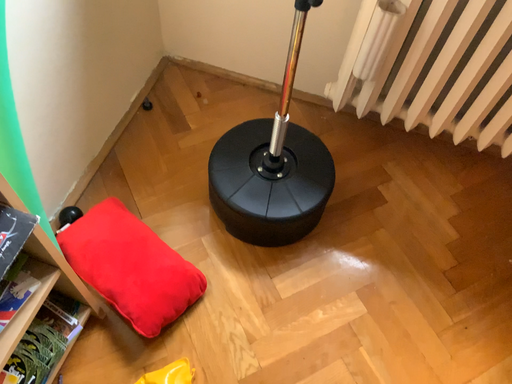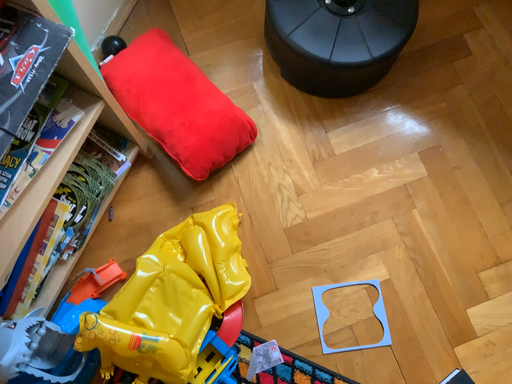
Question: How did the camera likely rotate when shooting the video?

Choices:
 (A) rotated downward
 (B) rotated upward

Answer: (A)